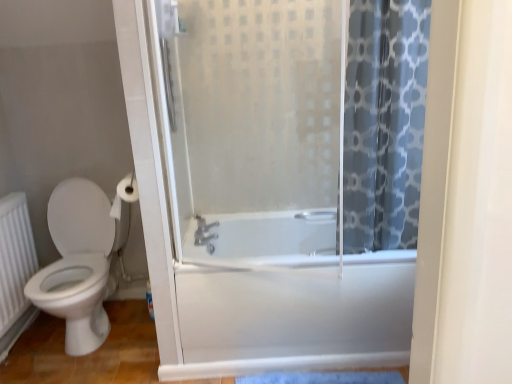
Question: From the image's perspective, is white matte toilet paper at upper left located beneath blue printed fabric at right?

Choices:
 (A) no
 (B) yes

Answer: (B)

Question: Is white matte toilet paper at upper left behind blue printed fabric at right?

Choices:
 (A) yes
 (B) no

Answer: (A)

Question: From a real-world perspective, is white matte toilet paper at upper left physically below blue printed fabric at right?

Choices:
 (A) no
 (B) yes

Answer: (B)

Question: Considering the relative sizes of white matte toilet paper at upper left and blue printed fabric at right in the image provided, is white matte toilet paper at upper left shorter than blue printed fabric at right?

Choices:
 (A) no
 (B) yes

Answer: (B)

Question: Is white matte toilet paper at upper left smaller than blue printed fabric at right?

Choices:
 (A) no
 (B) yes

Answer: (B)

Question: Relative to satin nickel faucet at center, is white matte toilet paper at upper left in front or behind?

Choices:
 (A) front
 (B) behind

Answer: (A)

Question: In terms of width, does white matte toilet paper at upper left look wider or thinner when compared to satin nickel faucet at center?

Choices:
 (A) wide
 (B) thin

Answer: (A)

Question: From the image's perspective, is white matte toilet paper at upper left above or below satin nickel faucet at center?

Choices:
 (A) below
 (B) above

Answer: (B)

Question: Which is correct: white matte toilet paper at upper left is inside satin nickel faucet at center, or outside of it?

Choices:
 (A) outside
 (B) inside

Answer: (A)

Question: From the image's perspective, is white matte toilet paper at upper left located above or below white glossy bathtub at center?

Choices:
 (A) below
 (B) above

Answer: (B)

Question: From a real-world perspective, is white matte toilet paper at upper left physically located above or below white glossy bathtub at center?

Choices:
 (A) below
 (B) above

Answer: (B)

Question: Is white matte toilet paper at upper left inside the boundaries of white glossy bathtub at center, or outside?

Choices:
 (A) inside
 (B) outside

Answer: (B)

Question: Relative to white glossy bathtub at center, is white matte toilet paper at upper left in front or behind?

Choices:
 (A) front
 (B) behind

Answer: (A)

Question: Is white textured radiator at lower left wider or thinner than white matte toilet paper at upper left?

Choices:
 (A) thin
 (B) wide

Answer: (A)

Question: In terms of height, does white textured radiator at lower left look taller or shorter compared to white matte toilet paper at upper left?

Choices:
 (A) tall
 (B) short

Answer: (A)